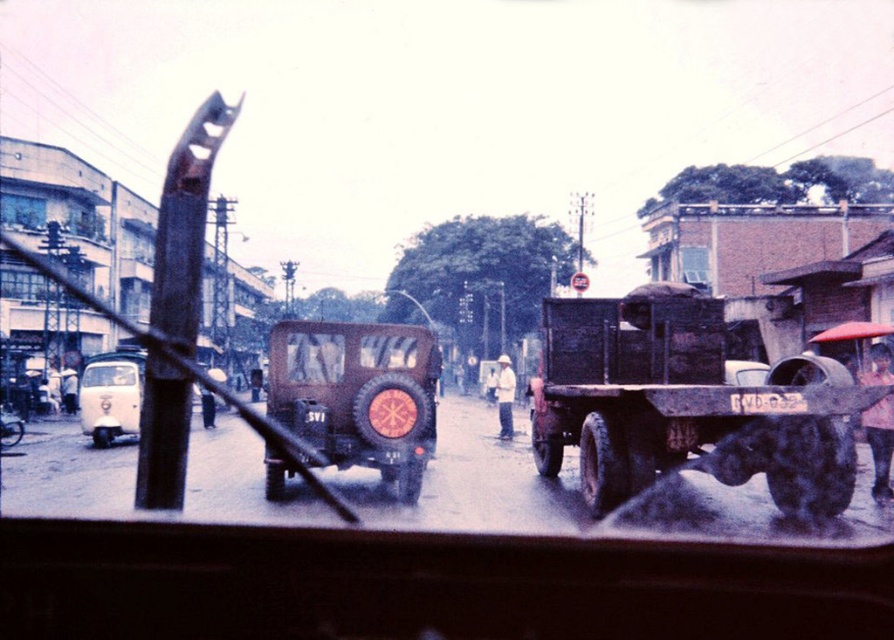
You are a photographer trying to capture the entire matte brown military vehicle at center and the white plastic license plate at center in a single frame. Based on their sizes, do you think both can fit within the camera frame without cropping?

The matte brown military vehicle at center might be wider than the white plastic license plate at center, so there is a possibility that the vehicle may not fit entirely within the frame if the license plate is already occupying significant width. However, without exact measurements, it is uncertain.

You are a delivery driver needing to pass through the area between the white matte van at left and the white plastic license plate at center. Your vehicle is 2.5 meters wide. Can you safely navigate this space?

The distance between the white matte van at left and the white plastic license plate at center is 7.05 meters. Since your vehicle is only 2.5 meters wide, there is sufficient space to safely navigate through the area between them.

You are a passenger in the vehicle and notice a white matte van at left. Based on its position in the image, can you estimate its location relative to the center of the scene?

The white matte van at left is located at point 0.619 along the horizontal axis and 0.125 along the vertical axis, which places it to the left and slightly below the center of the scene.